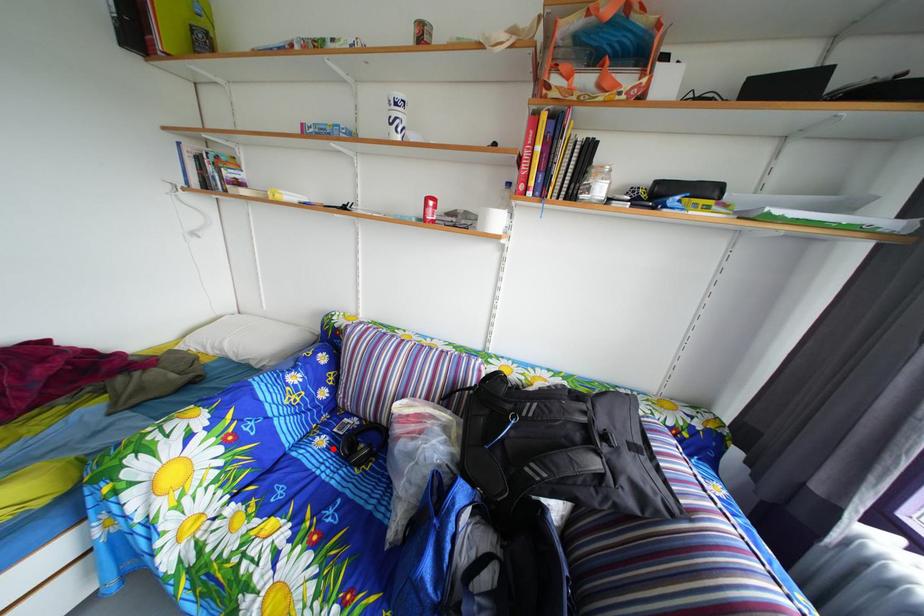
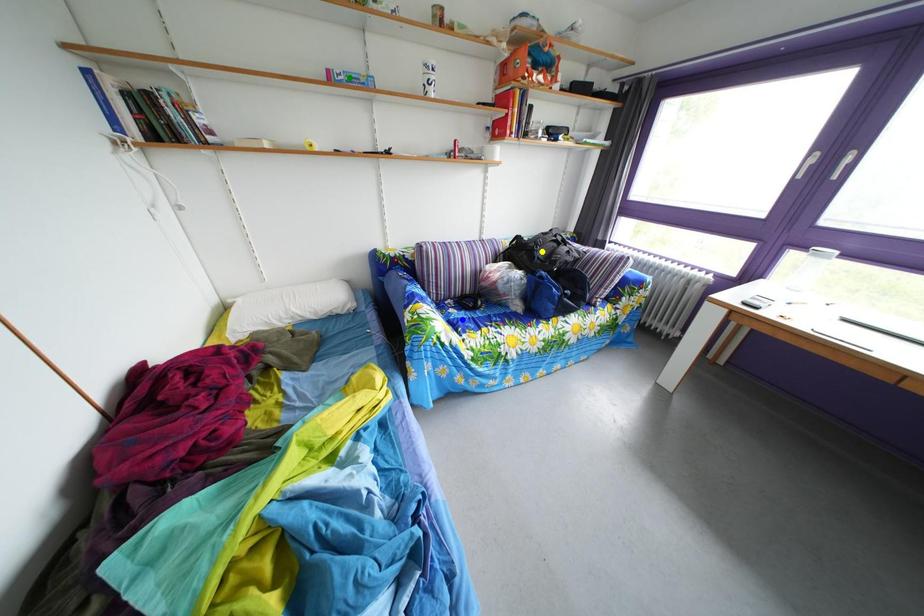
Question: I am providing you with two images of the same scene from different viewpoints. A red point is marked on the first image. You are given multiple points on the second image. Which spot in image 2 lines up with the point in image 1?

Choices:
 (A) yellow point
 (B) green point
 (C) blue point

Answer: (C)